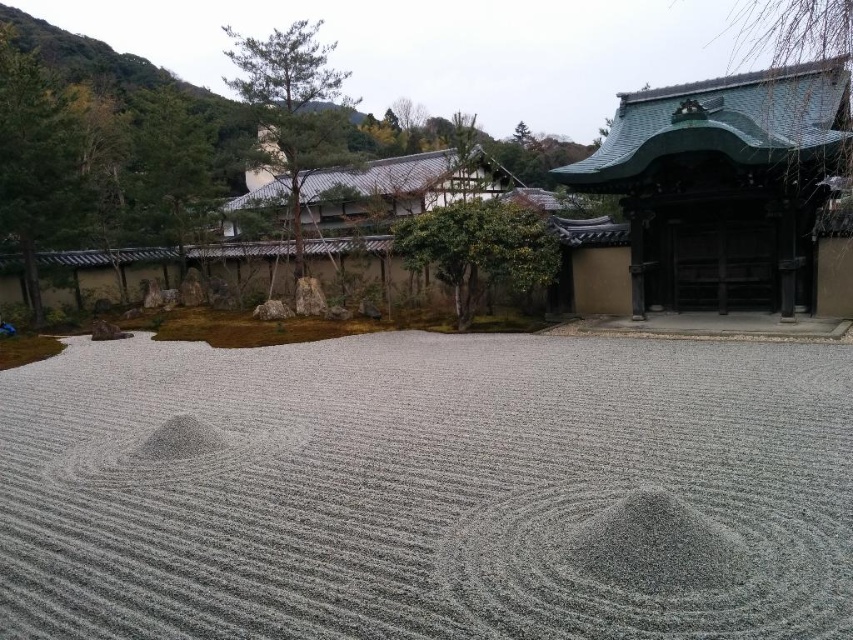
Question: Considering the relative positions of gray gravel at center and green tiled roof at upper right in the image provided, where is gray gravel at center located with respect to green tiled roof at upper right?

Choices:
 (A) left
 (B) right

Answer: (A)

Question: Does gray gravel at center have a smaller size compared to green tiled roof at upper right?

Choices:
 (A) yes
 (B) no

Answer: (A)

Question: Is gray gravel at center below green tiled roof at upper right?

Choices:
 (A) yes
 (B) no

Answer: (A)

Question: Among these objects, which one is farthest from the camera?

Choices:
 (A) gray gravel at center
 (B) green tiled roof at upper right

Answer: (B)

Question: Among these points, which one is nearest to the camera?

Choices:
 (A) (265, 424)
 (B) (693, 264)

Answer: (A)